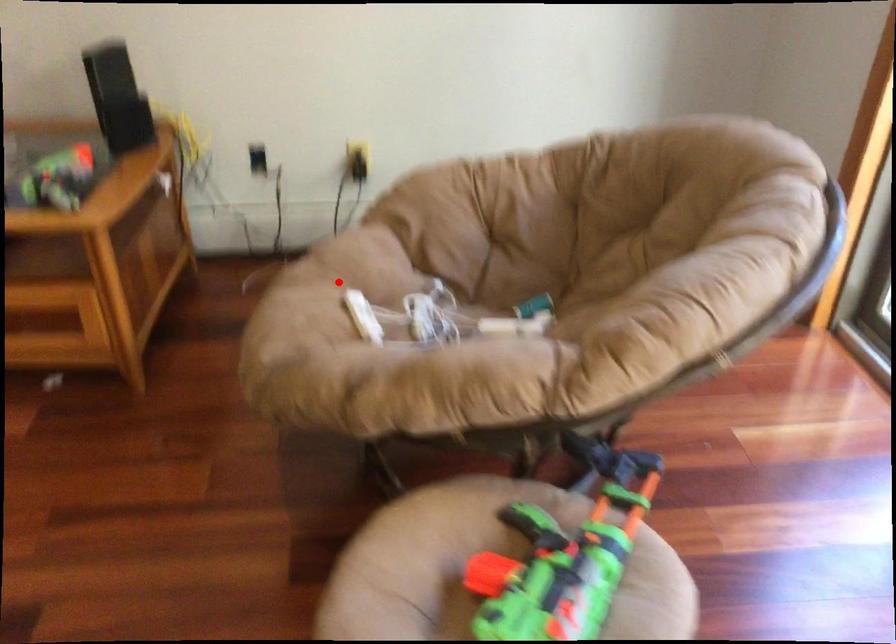
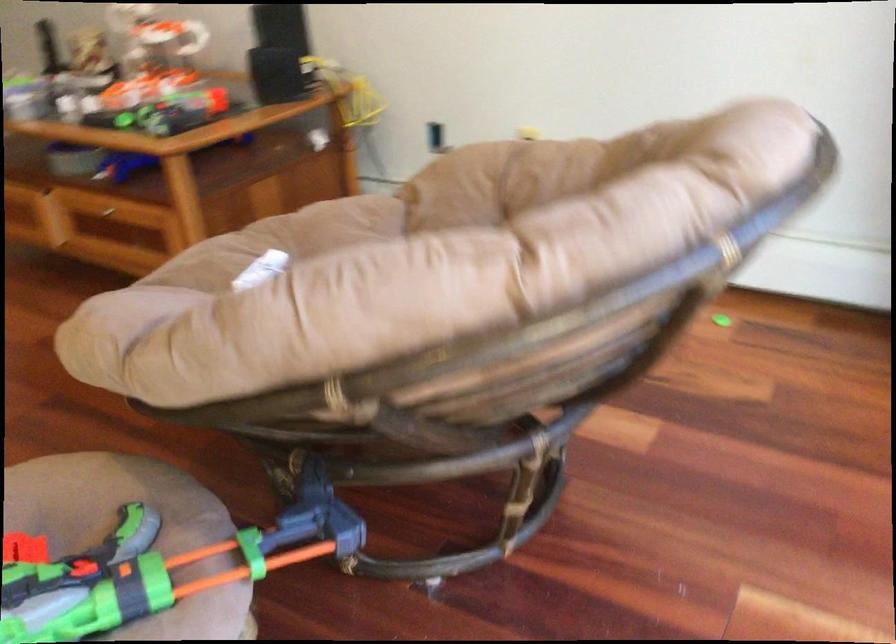
Locate, in the second image, the point that corresponds to the highlighted location in the first image.

(281, 241)